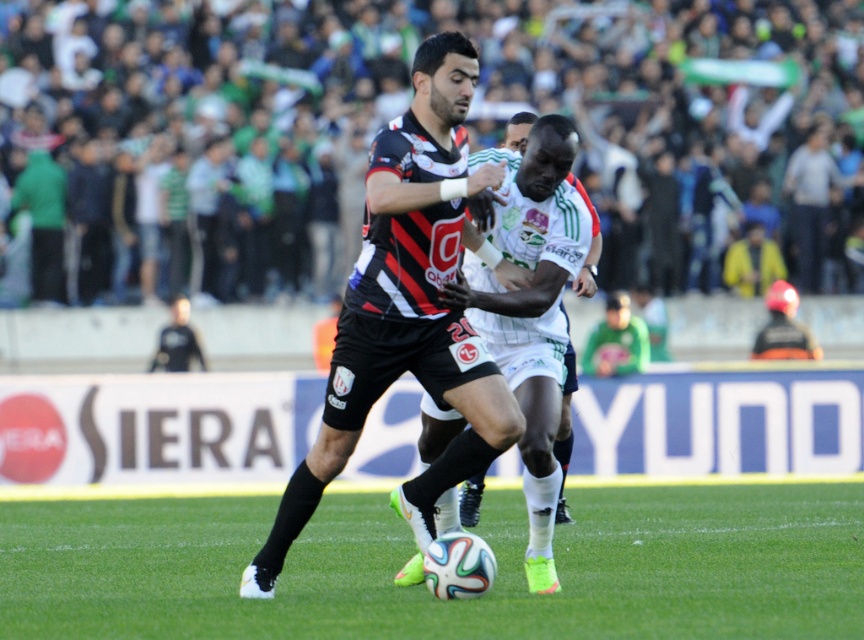
You are a soccer player standing on the field and see the green fabric crowd at upper center and the black matte jersey at center. Which object is higher up in the image?

The green fabric crowd at upper center is located above the black matte jersey at center, so it is higher up in the image.

You are a soccer player positioned at the center of the field. You notice a point at coordinates (x=405, y=108). What object is located at that point?

At point (x=405, y=108) lies the green fabric crowd at upper center.

You are a photographer trying to capture the soccer match. You notice the green fabric crowd at upper center and the green grass at center. Which of these two elements takes up more horizontal space in the image?

The green fabric crowd at upper center takes up more horizontal space than the green grass at center because its width is larger.